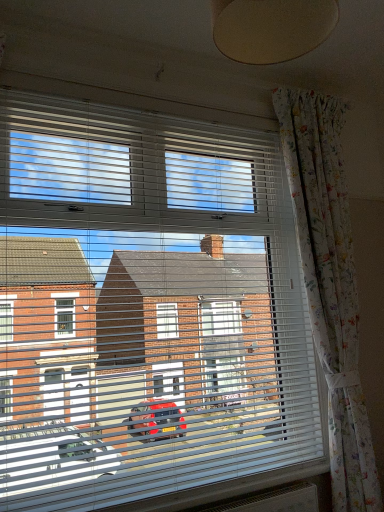
This screenshot has width=384, height=512. What do you see at coordinates (134, 170) in the screenshot?
I see `white plastic blinds at upper center` at bounding box center [134, 170].

In order to click on white plastic blinds at upper center in this screenshot , I will do (134, 170).

Identify the location of white plastic blinds at upper center. Image resolution: width=384 pixels, height=512 pixels. (134, 170).